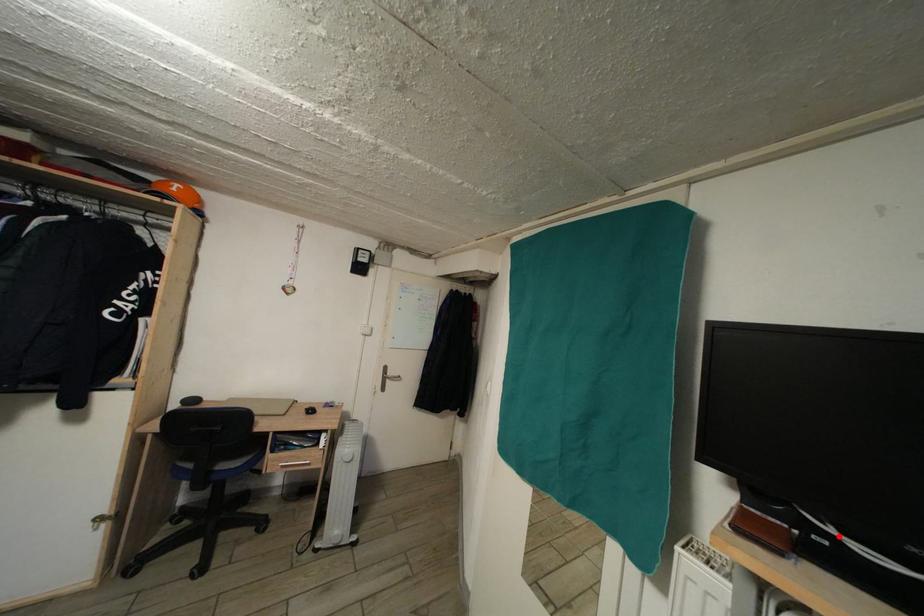
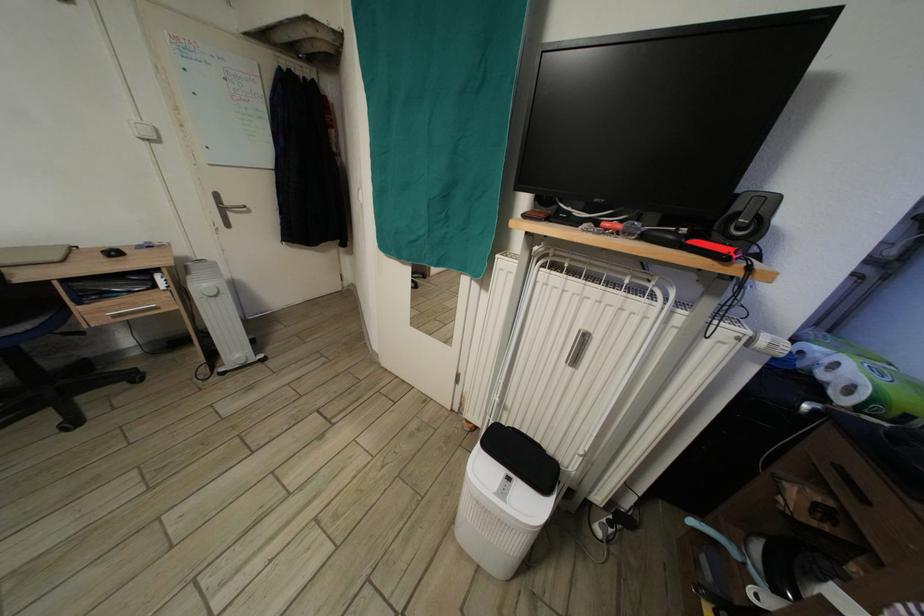
The point at the highlighted location is marked in the first image. Where is the corresponding point in the second image?

(576, 216)